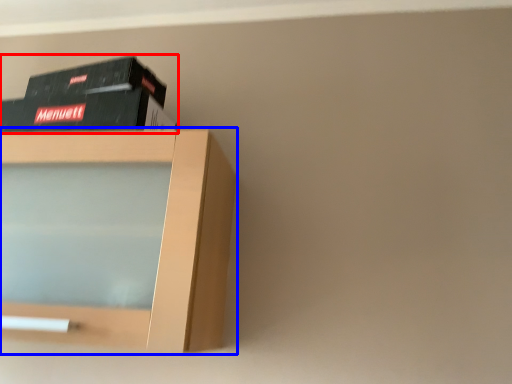
Question: Which object is further to the camera taking this photo, book (highlighted by a red box) or shelf (highlighted by a blue box)?

Choices:
 (A) book
 (B) shelf

Answer: (A)